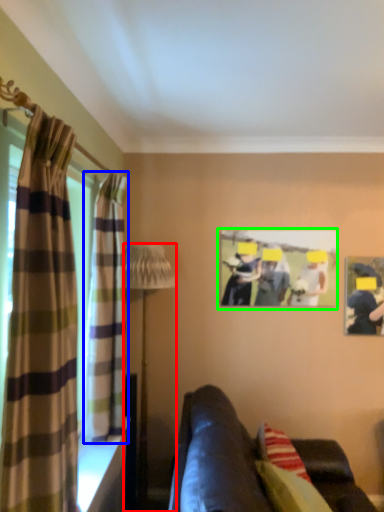
Question: Considering the real-world distances, which object is closest to lamp (highlighted by a red box)? curtain (highlighted by a blue box) or picture frame (highlighted by a green box).

Choices:
 (A) curtain
 (B) picture frame

Answer: (A)